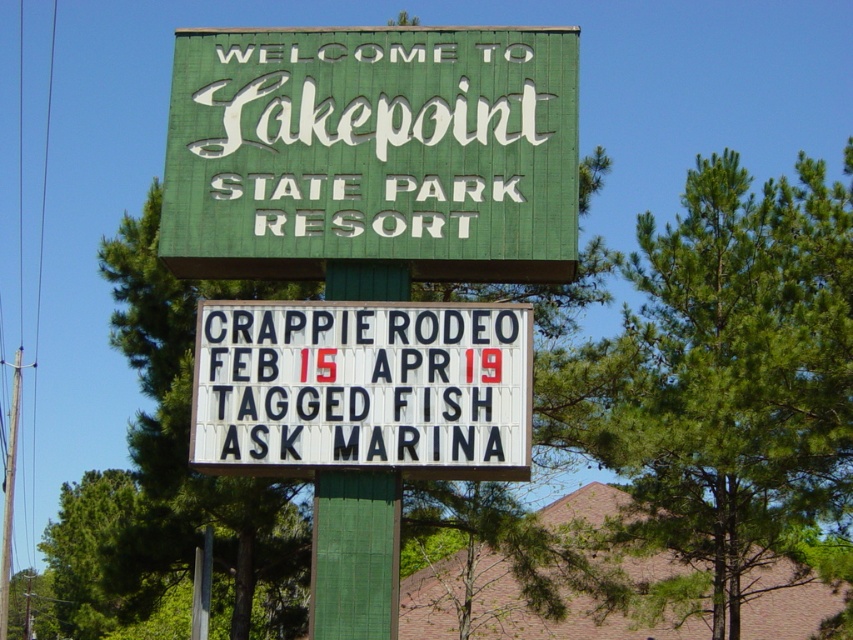
You are designing a new layout for the signboard and need to know the spatial relationship between the green painted wood signboard at upper center and the white plastic letters at center. Which object is wider?

The green painted wood signboard at upper center might be wider than white plastic letters at center.

You are a park visitor who wants to know which object is shorter between the green painted wood signboard at upper center and the green painted wood pole at center. Can you tell me?

The green painted wood signboard at upper center has a lesser height compared to the green painted wood pole at center, so the signboard is shorter.